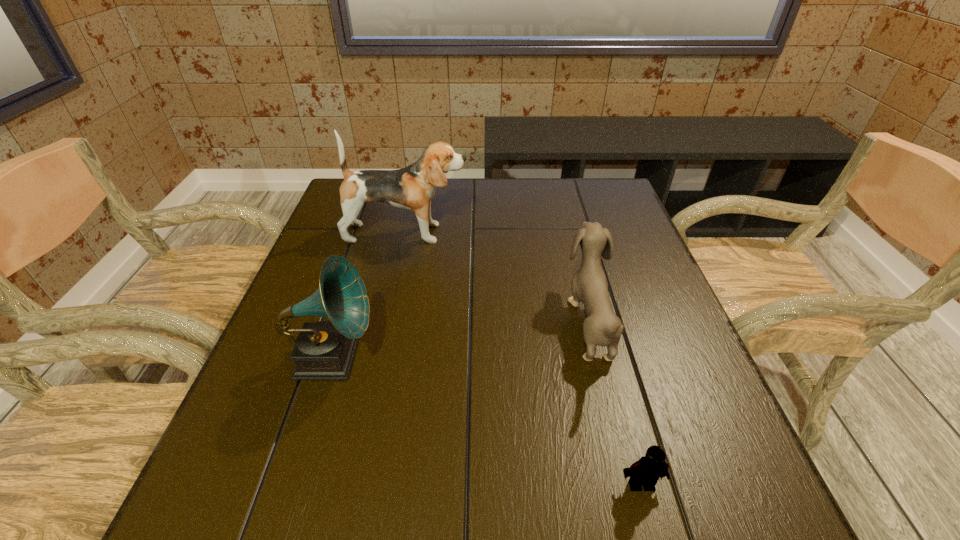
In the image, there is a desktop. At what (x,y) coordinates should I click in order to perform the action: click on vacant space at the left edge. Please return your answer as a coordinate pair (x, y). The height and width of the screenshot is (540, 960). Looking at the image, I should click on (253, 382).

You are a GUI agent. You are given a task and a screenshot of the screen. Output one action in this format:
    pyautogui.click(x=<x>, y=<y>)
    Task: Click on the free space at the right edge of the desktop
    The image size is (960, 540).
    Given the screenshot: What is the action you would take?
    pyautogui.click(x=636, y=356)

Locate an element on the screen. The width and height of the screenshot is (960, 540). vacant point at the far left corner is located at coordinates (385, 207).

What are the coordinates of `vacant space at the far right corner of the desktop` in the screenshot? It's located at 599,181.

The width and height of the screenshot is (960, 540). I want to click on free spot between the farthest object and the shorter puppy, so click(x=497, y=278).

The height and width of the screenshot is (540, 960). Find the location of `unoccupied position between the shorter puppy and the phonograph_record`. unoccupied position between the shorter puppy and the phonograph_record is located at coordinates (461, 340).

Image resolution: width=960 pixels, height=540 pixels. In order to click on vacant area between the nearer puppy and the phonograph_record in this screenshot , I will do `click(461, 340)`.

Where is `empty space that is in between the phonograph_record and the Lego`? empty space that is in between the phonograph_record and the Lego is located at coordinates (487, 421).

Locate an element on the screen. The image size is (960, 540). free space between the third tallest object and the phonograph_record is located at coordinates (461, 340).

At what (x,y) coordinates should I click in order to perform the action: click on free spot between the shorter puppy and the taller puppy. Please return your answer as a coordinate pair (x, y). Looking at the image, I should click on (497, 278).